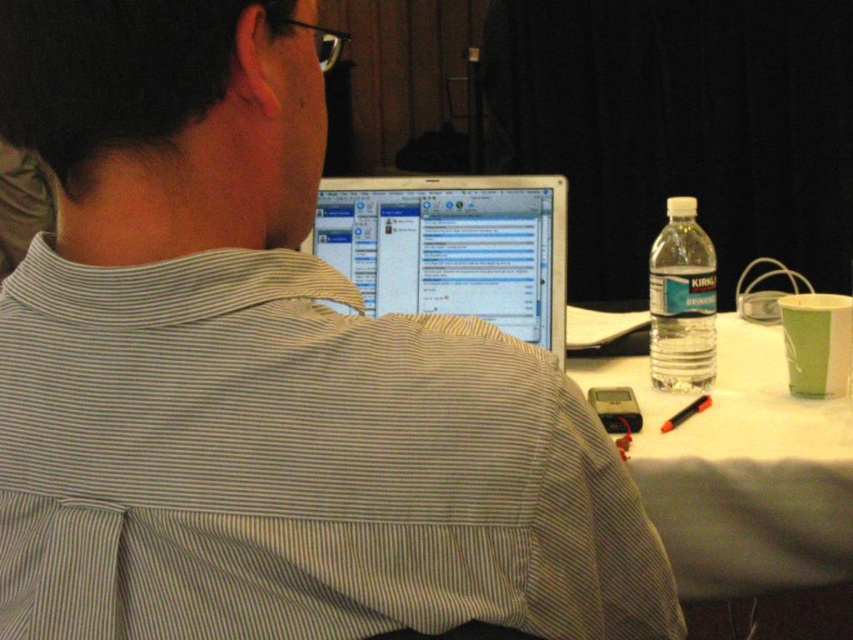
Question: Which point is farther to the camera?

Choices:
 (A) white paper at center
 (B) clear plastic water bottle at right

Answer: (B)

Question: Can you confirm if shiny silver laptop at center is bigger than clear plastic water bottle at right?

Choices:
 (A) yes
 (B) no

Answer: (A)

Question: Does white paper at center have a greater width compared to shiny silver laptop at center?

Choices:
 (A) no
 (B) yes

Answer: (B)

Question: Where is white paper at center located in relation to shiny silver laptop at center in the image?

Choices:
 (A) right
 (B) left

Answer: (A)

Question: Which of the following is the farthest from the observer?

Choices:
 (A) (666, 269)
 (B) (424, 275)
 (C) (648, 396)

Answer: (B)

Question: Which point is closer to the camera?

Choices:
 (A) clear plastic water bottle at right
 (B) shiny silver laptop at center
 (C) white paper at center

Answer: (C)